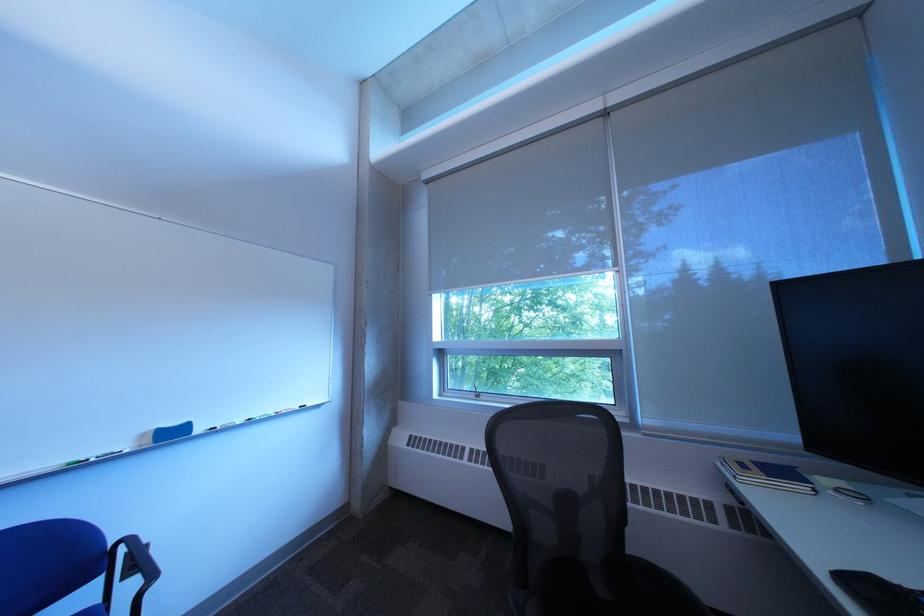
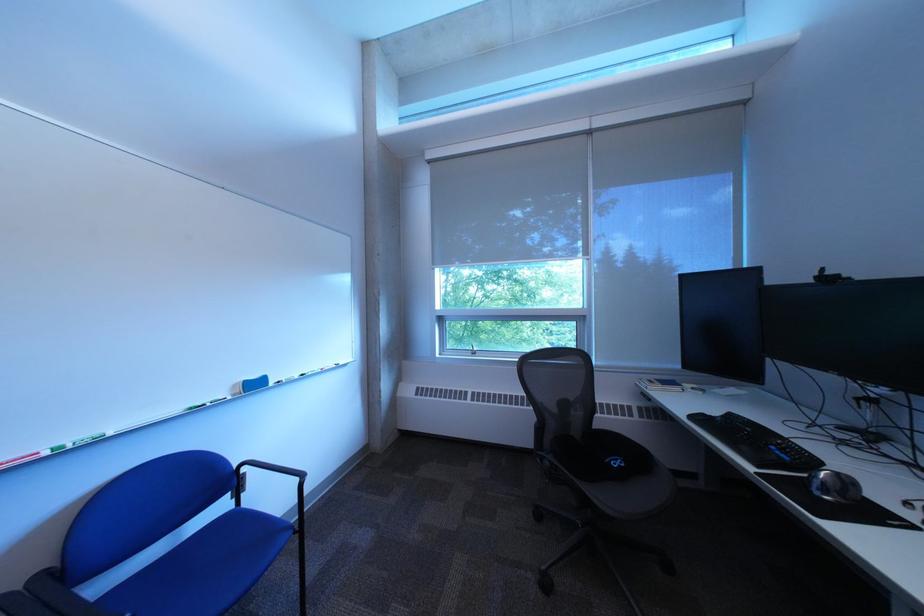
Where in the second image is the point corresponding to the point at 860,582 from the first image?

(708, 419)